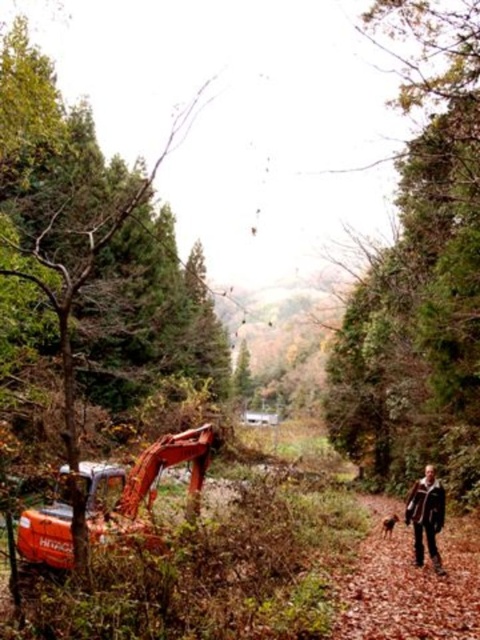
Question: Which point appears farthest from the camera in this image?

Choices:
 (A) (67, 179)
 (B) (423, 490)
 (C) (107, 490)
 (D) (435, 356)

Answer: (A)

Question: Which is farther from the green leafy tree at right?

Choices:
 (A) orange metallic excavator at lower left
 (B) brown furry dog at lower right
 (C) brown leather jacket at lower right

Answer: (C)

Question: Does orange metallic excavator at left appear on the right side of orange metallic excavator at lower left?

Choices:
 (A) yes
 (B) no

Answer: (B)

Question: Can you confirm if orange metallic excavator at left is positioned to the left of brown furry dog at lower right?

Choices:
 (A) no
 (B) yes

Answer: (B)

Question: Among these objects, which one is farthest from the camera?

Choices:
 (A) brown furry dog at lower right
 (B) brown leather jacket at lower right

Answer: (A)

Question: Does orange metallic excavator at left appear over brown furry dog at lower right?

Choices:
 (A) no
 (B) yes

Answer: (B)